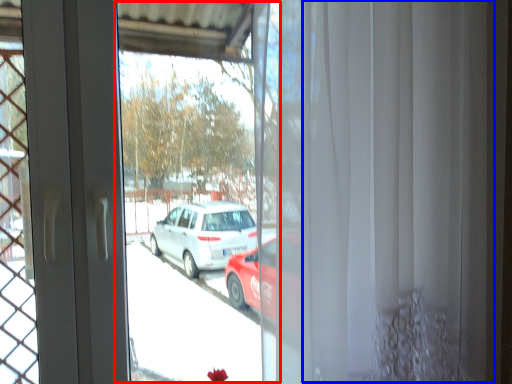
Question: Which point is further to the camera, shop window (highlighted by a red box) or curtain (highlighted by a blue box)?

Choices:
 (A) shop window
 (B) curtain

Answer: (A)